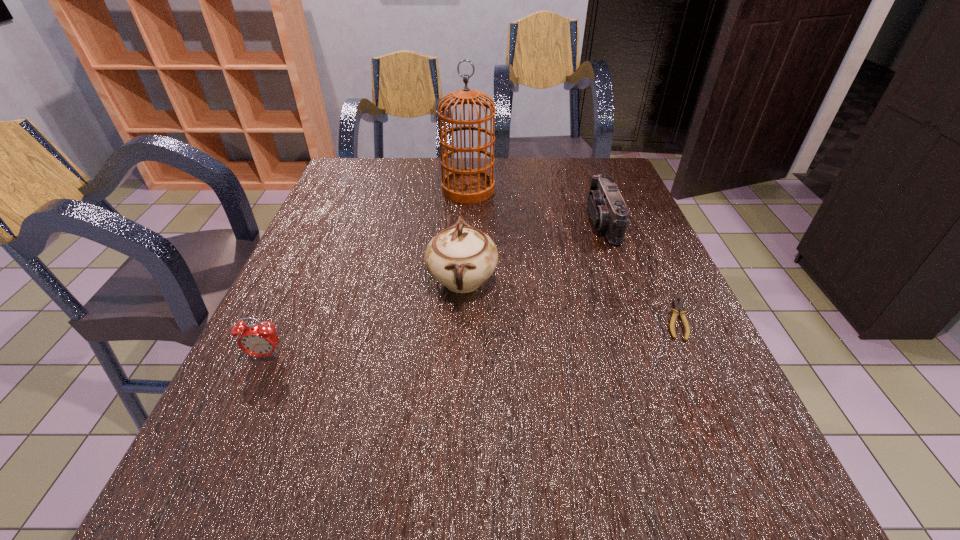
Locate an element on the screen. birdcage is located at coordinates (468, 185).

This screenshot has height=540, width=960. I want to click on chinaware, so click(x=461, y=258).

The height and width of the screenshot is (540, 960). Identify the location of camcorder. (608, 211).

Locate an element on the screen. This screenshot has height=540, width=960. the nearest object is located at coordinates (260, 340).

Locate an element on the screen. alarm clock is located at coordinates (260, 340).

Where is `the rightmost object`? the rightmost object is located at coordinates (678, 307).

Locate an element on the screen. The height and width of the screenshot is (540, 960). pliers is located at coordinates (678, 307).

The height and width of the screenshot is (540, 960). In order to click on vacant space located 0.320m on the left of the tallest object in this screenshot , I will do `click(335, 190)`.

This screenshot has height=540, width=960. Identify the location of vacant area situated 0.300m on the left of the chinaware. (296, 281).

Where is `free space located on the front-facing side of the fourth object from left to right`? free space located on the front-facing side of the fourth object from left to right is located at coordinates (473, 222).